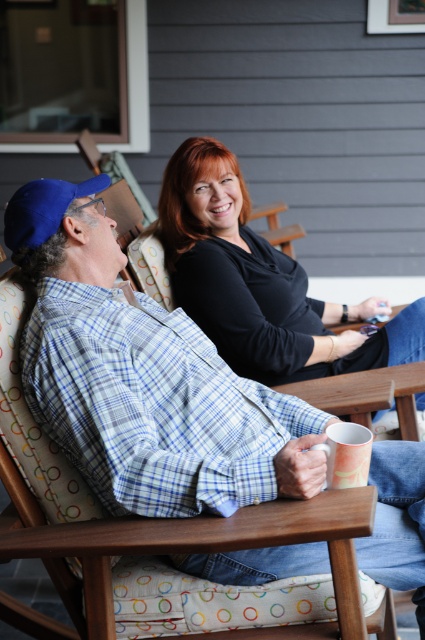
You are standing in front of the porch and want to hand a gift to the person wearing the blue plaid shirt at upper left. Considering your height is 1.7 meters, can you comfortably reach them without needing a stool?

The blue plaid shirt at upper left is 1.38 meters away from viewer, so yes, you can comfortably reach them without needing a stool since the distance is within a comfortable arm reach.

You are a photographer standing in front of the porch. You need to take a photo that includes both the blue plaid shirt at upper left and the black matte shirt at upper center. Based on their positions, which shirt should you focus on first to ensure both are in frame?

The blue plaid shirt at upper left is below the black matte shirt at upper center, so you should focus on the black matte shirt at upper center first to ensure both are in frame.